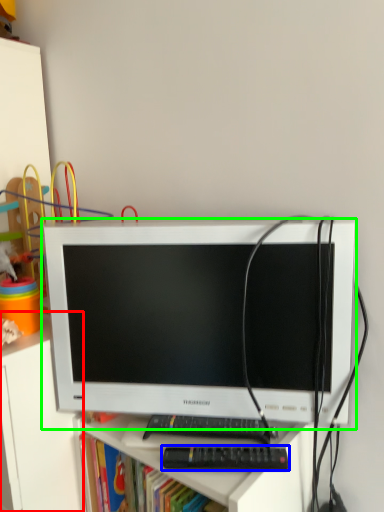
Question: Considering the real-world distances, which object is farthest from file cabinet (highlighted by a red box)? control (highlighted by a blue box) or computer monitor (highlighted by a green box)?

Choices:
 (A) control
 (B) computer monitor

Answer: (A)